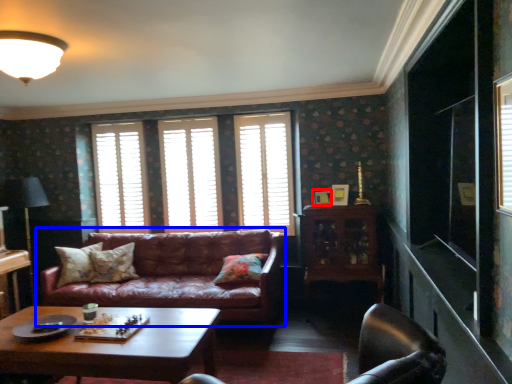
Question: Which object appears farthest to the camera in this image, picture frame (highlighted by a red box) or studio couch (highlighted by a blue box)?

Choices:
 (A) picture frame
 (B) studio couch

Answer: (A)